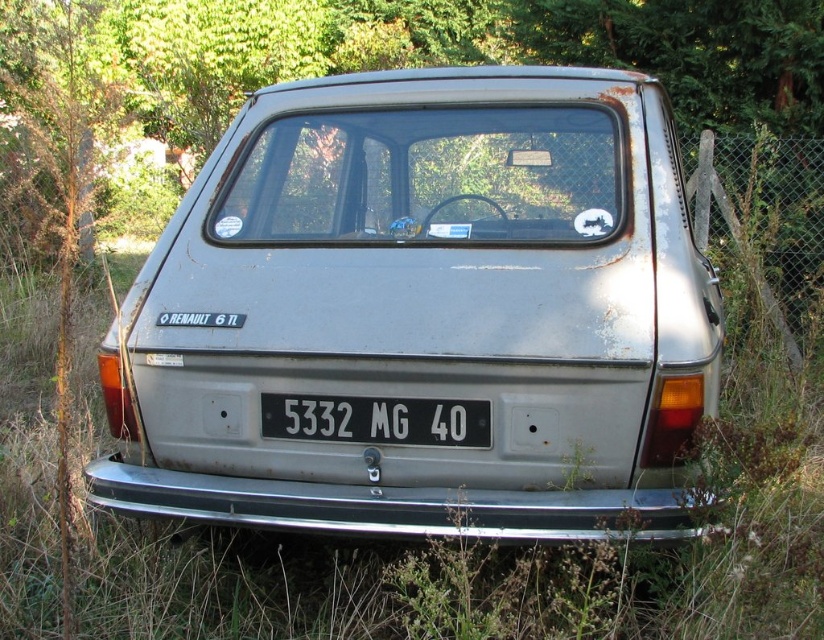
You are a surveyor using a coordinate system where the bottom left corner is the origin. You need to locate the rusty metal car at center in the image. What are its coordinates?

The coordinates of the rusty metal car at center are at point (424, 308).

You are a photographer standing at a certain distance from the rusty metal car at center. You want to take a photo of it without any obstructions. The camera you are using has a minimum focusing distance of 1.5 meters. Can you take the photo from your current position?

The rusty metal car at center is 1.33 meters away from camera. Since the minimum focusing distance of the camera is 1.5 meters, the camera cannot focus properly at 1.33 meters. Therefore, you need to move back to ensure the distance is at least 1.5 meters to take a clear photo without obstructions.

You are a delivery person trying to determine if the rusty metal car at center is taller than the white plastic license plate at center. Based on the scene, can you confirm which one is taller?

The rusty metal car at center has a greater height compared to the white plastic license plate at center, so the rusty metal car at center is taller.